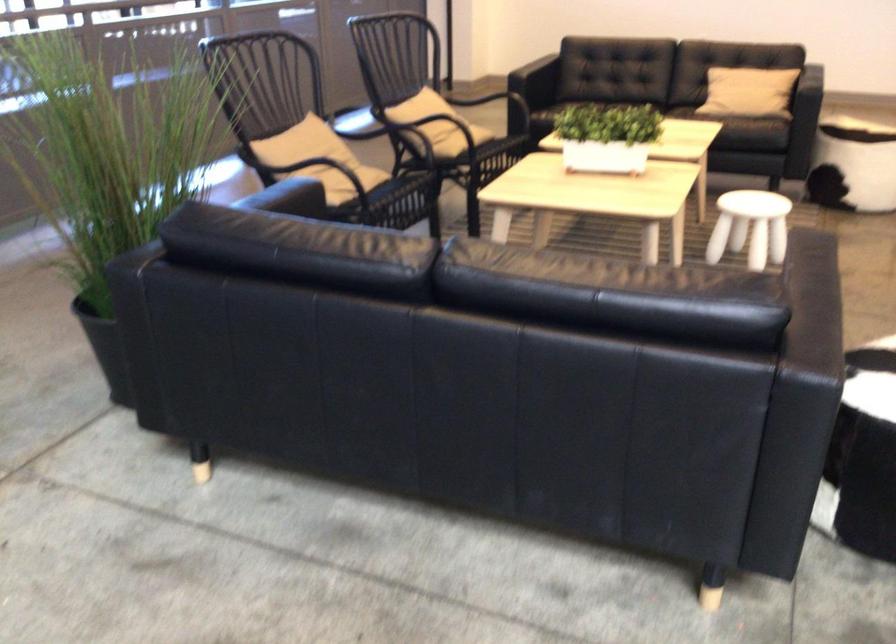
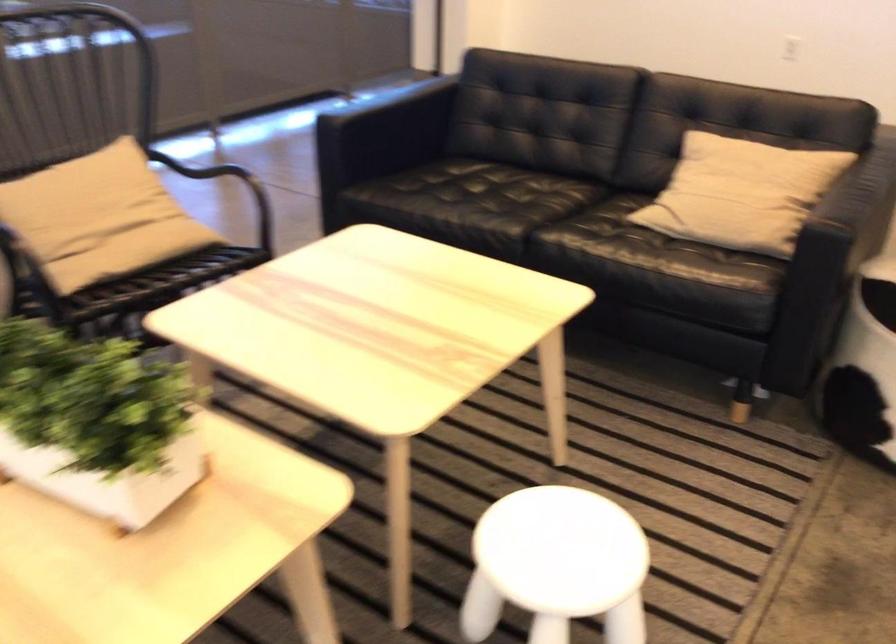
In a continuous first-person perspective shot, in which direction is the camera moving?

The movement direction of the cameraman is right, forward.